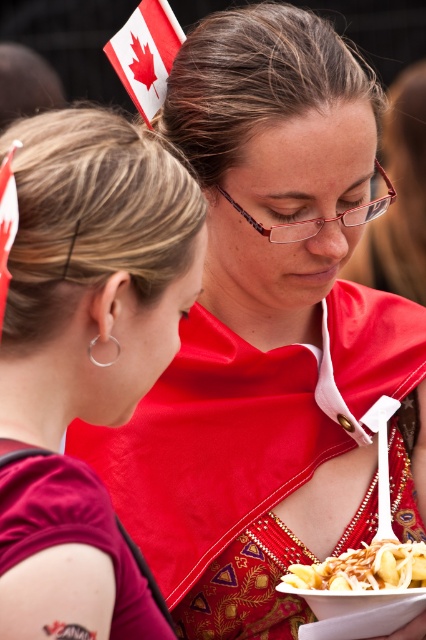
Can you confirm if matte red dress at center is positioned to the right of red fabric canadian flag at upper left?

Correct, you'll find matte red dress at center to the right of red fabric canadian flag at upper left.

Can you confirm if matte red dress at center is bigger than red fabric canadian flag at upper left?

Indeed, matte red dress at center has a larger size compared to red fabric canadian flag at upper left.

The height and width of the screenshot is (640, 426). Describe the element at coordinates (85, 358) in the screenshot. I see `matte red dress at center` at that location.

Identify the location of matte red dress at center. The image size is (426, 640). (85, 358).

Based on the photo, how much distance is there between red fabric flag at upper left and silver metallic earring at left?

red fabric flag at upper left and silver metallic earring at left are 1.20 meters apart.

From the picture: Does red fabric flag at upper left have a greater width compared to silver metallic earring at left?

Yes, red fabric flag at upper left is wider than silver metallic earring at left.

Where is `red fabric flag at upper left`? Image resolution: width=426 pixels, height=640 pixels. red fabric flag at upper left is located at coordinates pos(146,52).

Is point (123, 35) farther from viewer compared to point (405, 576)?

That is True.

Does red fabric flag at upper left have a lesser height compared to golden crispy fries at lower right?

Incorrect, red fabric flag at upper left's height does not fall short of golden crispy fries at lower right's.

Which is behind, point (137, 70) or point (379, 544)?

The point (137, 70) is behind.

Locate an element on the screen. red fabric flag at upper left is located at coordinates (146, 52).